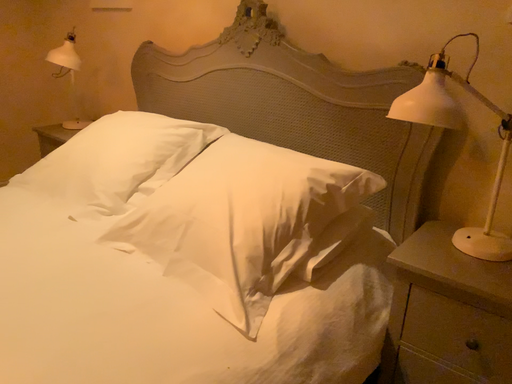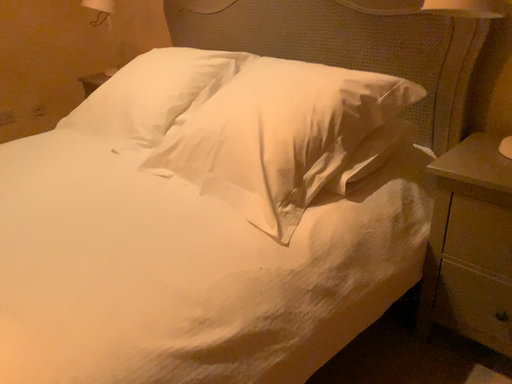
Question: How did the camera likely rotate when shooting the video?

Choices:
 (A) rotated left
 (B) rotated right

Answer: (A)